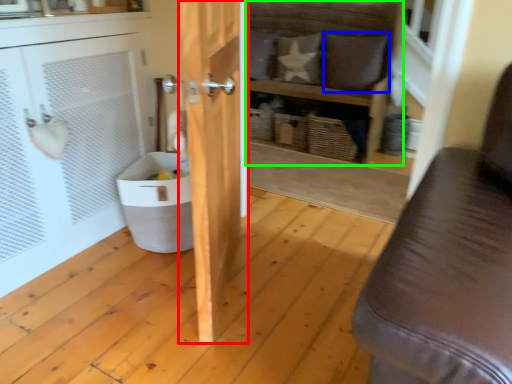
Question: Considering the real-world distances, which object is closest to door (highlighted by a red box)? pillow (highlighted by a blue box) or shelf (highlighted by a green box).

Choices:
 (A) pillow
 (B) shelf

Answer: (B)